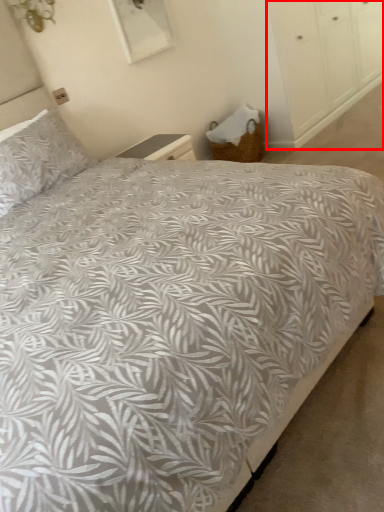
Question: From the image's perspective, what is the correct spatial positioning of dresser (annotated by the red box) in reference to pillow?

Choices:
 (A) above
 (B) below

Answer: (A)